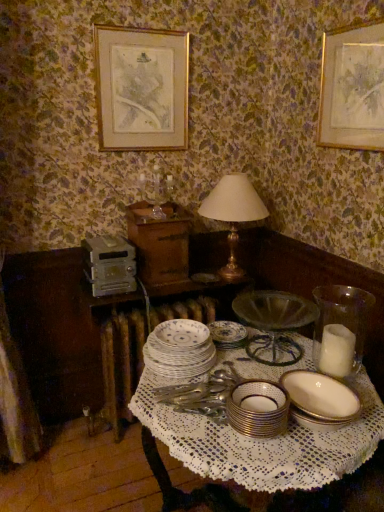
Where is `vacant space underneath porcelain plate at center (from a real-world perspective)`? This screenshot has height=512, width=384. vacant space underneath porcelain plate at center (from a real-world perspective) is located at coordinates (190, 338).